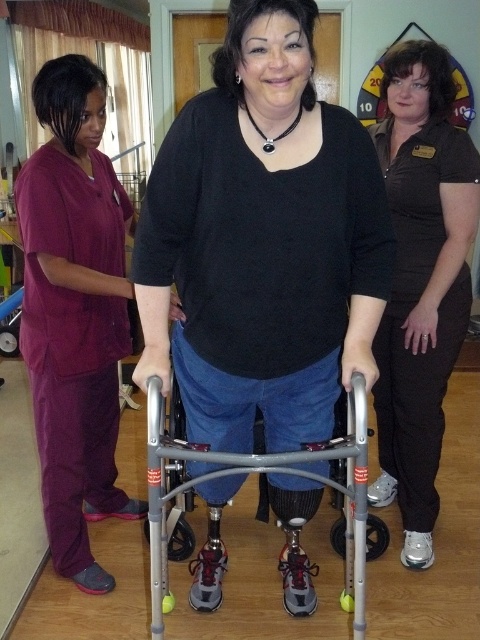
Question: Does black matte walker at center appear on the right side of black matte pants at center?

Choices:
 (A) yes
 (B) no

Answer: (B)

Question: Which object appears closest to the camera in this image?

Choices:
 (A) black matte pants at center
 (B) maroon scrubs at left

Answer: (B)

Question: Which object is the closest to the maroon scrubs at left?

Choices:
 (A) black matte walker at center
 (B) black matte pants at center

Answer: (A)

Question: In this image, where is maroon scrubs at left located relative to black matte pants at center?

Choices:
 (A) below
 (B) above

Answer: (A)

Question: Can you confirm if black matte walker at center is positioned below maroon scrubs at left?

Choices:
 (A) no
 (B) yes

Answer: (B)

Question: Estimate the real-world distances between objects in this image. Which object is farther from the black matte walker at center?

Choices:
 (A) black matte pants at center
 (B) maroon scrubs at left

Answer: (A)